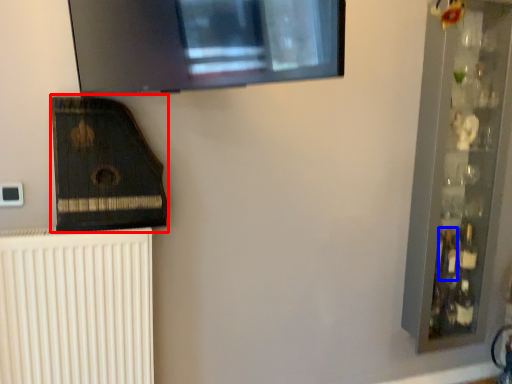
Question: Which point is closer to the camera, amplifier (highlighted by a red box) or bottle (highlighted by a blue box)?

Choices:
 (A) amplifier
 (B) bottle

Answer: (A)